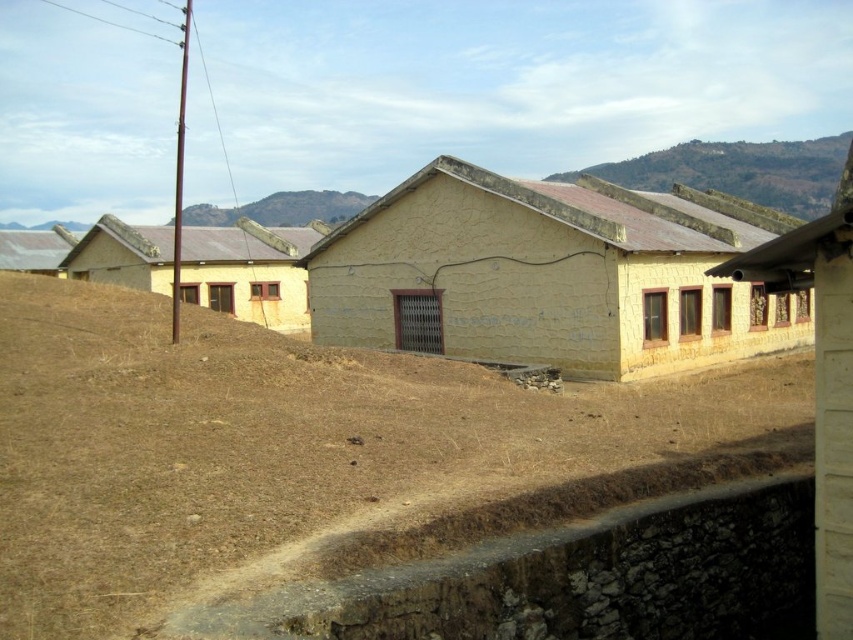
You are standing at the bottom edge of the image near the stone wall. You want to reach the brown soil at center. Which direction should you move in to get there?

You should move towards the center of the image to reach the brown soil at center, as it is located at point coordinates of (x=309, y=452).

You are standing at the point marked by point (x=248, y=272) in the image. Looking around, you see a yellow matte building at center. Based on the scene description, what is the most likely material used to construct the building?

The yellow matte building at center is most likely constructed from a light colored material such as concrete or plaster, as described in the scene.

You are a hiker standing at the base of the brown rocky hill at upper center and want to reach the brown soil at center. Which direction should you move to get there?

You should move downward towards the brown soil at center because it is closer to the viewer than the brown rocky hill at upper center, meaning the hill is elevated and the soil is at a lower elevation.